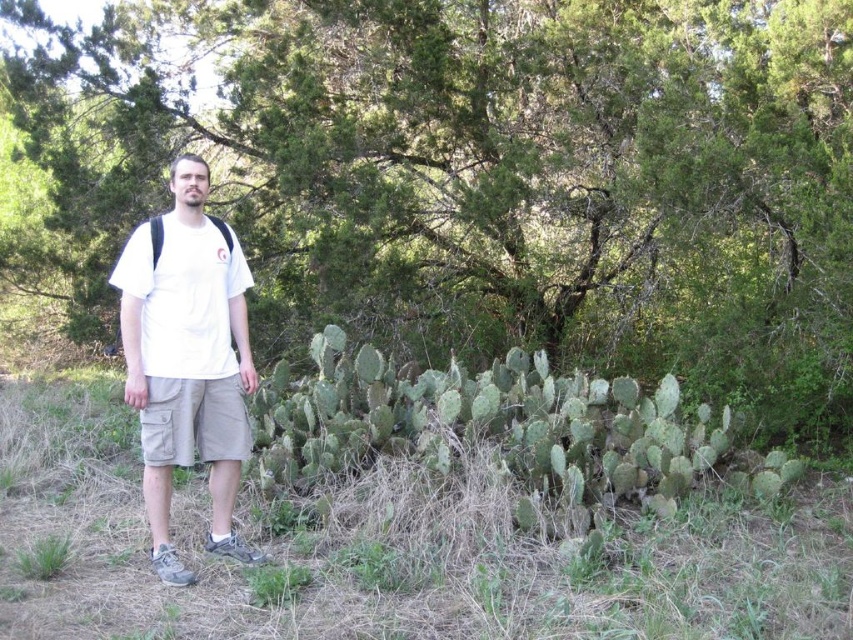
You are standing in a forest and want to reach a specific point marked at coordinates [726,248]. If you walk straight ahead, how far will you have to go to reach that point?

The point at coordinates [726,248] is 7.46 meters away from the viewer, so you will have to walk 7.46 meters straight ahead to reach it.